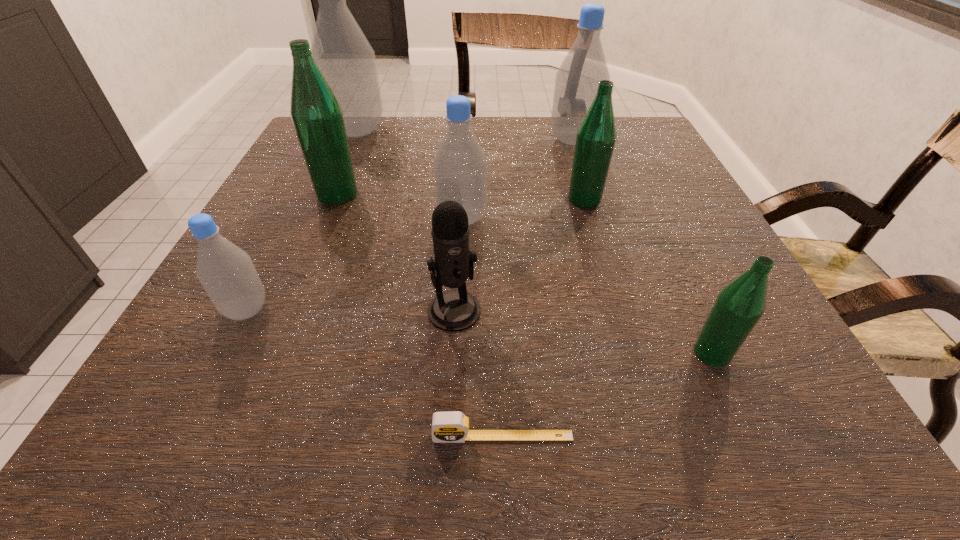
This screenshot has height=540, width=960. I want to click on the smallest green bottle, so click(x=739, y=306).

The width and height of the screenshot is (960, 540). What are the coordinates of `the nearest bottle` in the screenshot? It's located at point(739,306).

Identify the location of the shortest object. Image resolution: width=960 pixels, height=540 pixels. (447, 427).

At what (x,y) coordinates should I click in order to perform the action: click on the nearest object. Please return your answer as a coordinate pair (x, y). The height and width of the screenshot is (540, 960). Looking at the image, I should click on (447, 427).

The height and width of the screenshot is (540, 960). In order to click on free space located 0.140m on the front of the tallest bottle in this screenshot , I will do `click(339, 174)`.

The width and height of the screenshot is (960, 540). Find the location of `vacant point located on the right of the rightmost gray bottle`. vacant point located on the right of the rightmost gray bottle is located at coordinates point(625,140).

Image resolution: width=960 pixels, height=540 pixels. Find the location of `vacant space located 0.320m on the back of the biggest green bottle`. vacant space located 0.320m on the back of the biggest green bottle is located at coordinates (369, 119).

Image resolution: width=960 pixels, height=540 pixels. What are the coordinates of `free space located 0.090m on the back of the second green bottle from left to right` in the screenshot? It's located at click(x=575, y=168).

Find the location of a particular element. The image size is (960, 540). vacant space situated on the left of the fourth bottle from right to left is located at coordinates (362, 218).

Locate an element on the screen. vacant space located 0.310m on the back of the black microphone is located at coordinates (461, 188).